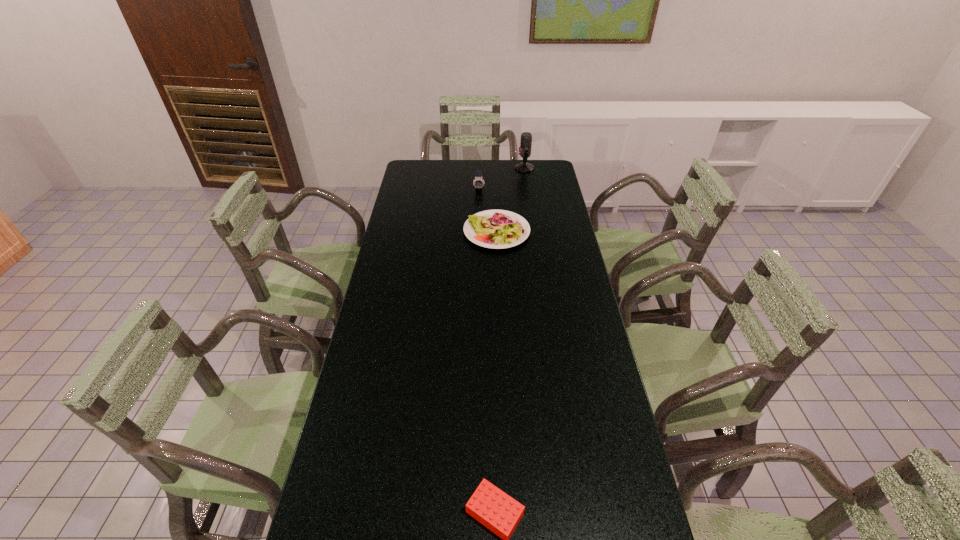
In order to click on blank space located 0.170m on the left of the salad plate in this screenshot , I will do `click(422, 231)`.

Locate an element on the screen. Image resolution: width=960 pixels, height=540 pixels. microphone that is at the far edge is located at coordinates (526, 138).

Locate an element on the screen. The width and height of the screenshot is (960, 540). watch present at the far edge is located at coordinates (478, 182).

Locate an element on the screen. The image size is (960, 540). object that is at the right edge is located at coordinates (526, 138).

Identify the location of object located in the far right corner section of the desktop. This screenshot has width=960, height=540. (526, 138).

In the image, there is a desktop. Find the location of `free space at the far edge`. free space at the far edge is located at coordinates (494, 179).

At what (x,y) coordinates should I click in order to perform the action: click on vacant region at the right edge. Please return your answer as a coordinate pair (x, y). This screenshot has width=960, height=540. Looking at the image, I should click on (560, 246).

Locate an element on the screen. Image resolution: width=960 pixels, height=540 pixels. vacant space at the far left corner is located at coordinates (416, 177).

This screenshot has width=960, height=540. What are the coordinates of `blank region between the third nearest object and the salad plate` in the screenshot? It's located at (488, 210).

Where is `free point between the second shortest object and the farthest object`? The width and height of the screenshot is (960, 540). free point between the second shortest object and the farthest object is located at coordinates (511, 200).